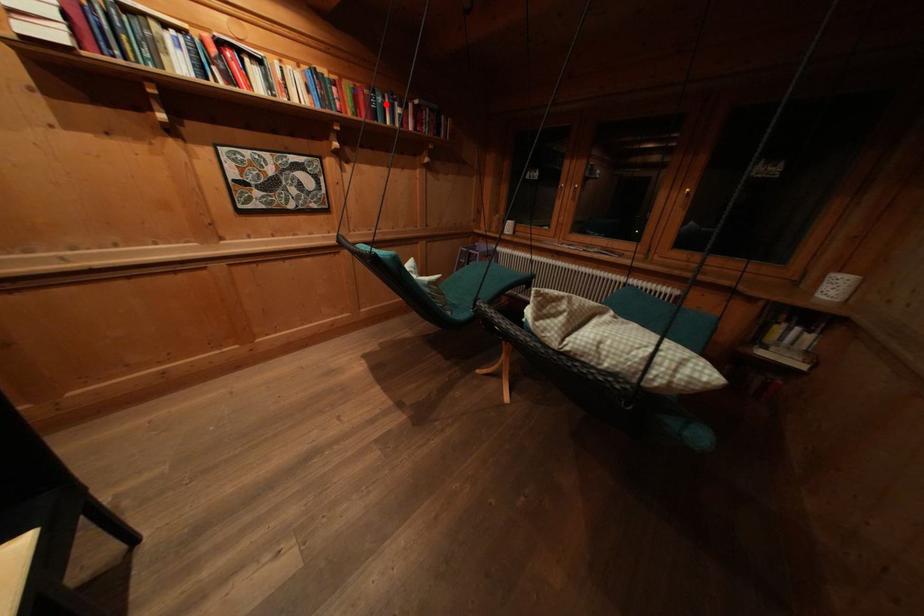
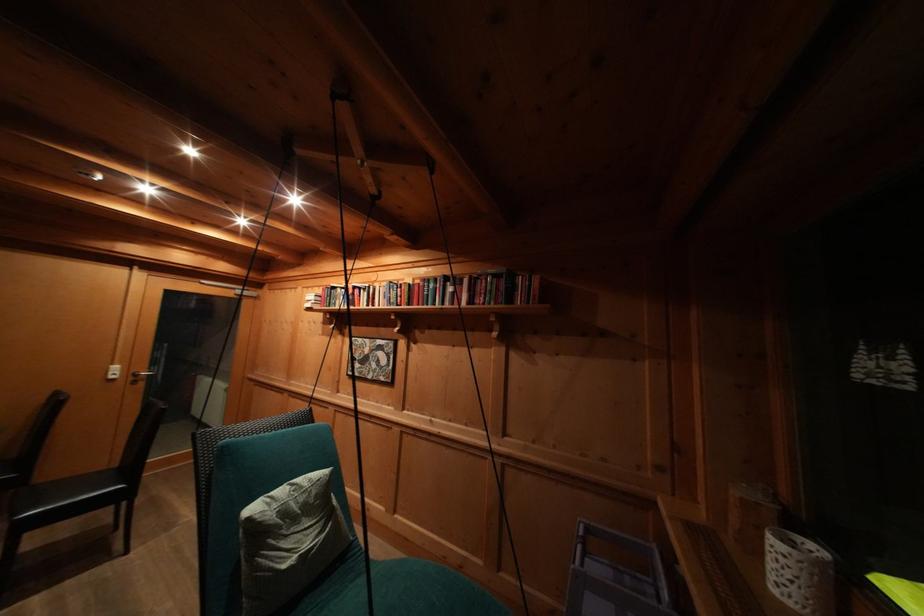
Question: I am providing you with two images of the same scene from different viewpoints. A red point is shown in image1. For the corresponding object point in image2, is it positioned nearer or farther from the camera?

Choices:
 (A) Nearer
 (B) Farther

Answer: (B)